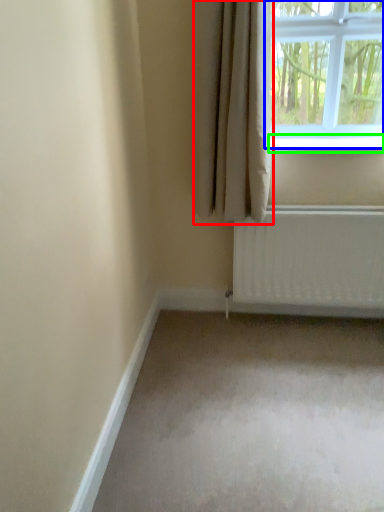
Question: Which is nearer to the curtain (highlighted by a red box)? window (highlighted by a blue box) or window sill (highlighted by a green box).

Choices:
 (A) window
 (B) window sill

Answer: (B)